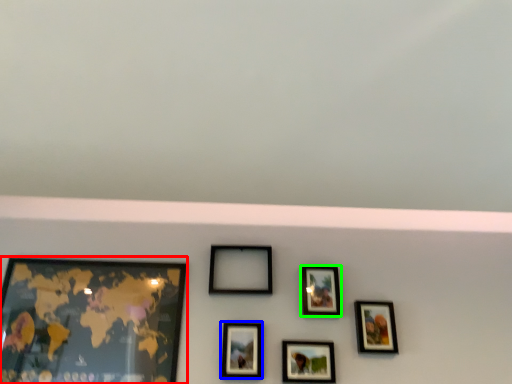
Question: Which object is positioned farthest from picture frame (highlighted by a red box)? Select from picture frame (highlighted by a blue box) and picture frame (highlighted by a green box).

Choices:
 (A) picture frame
 (B) picture frame

Answer: (B)